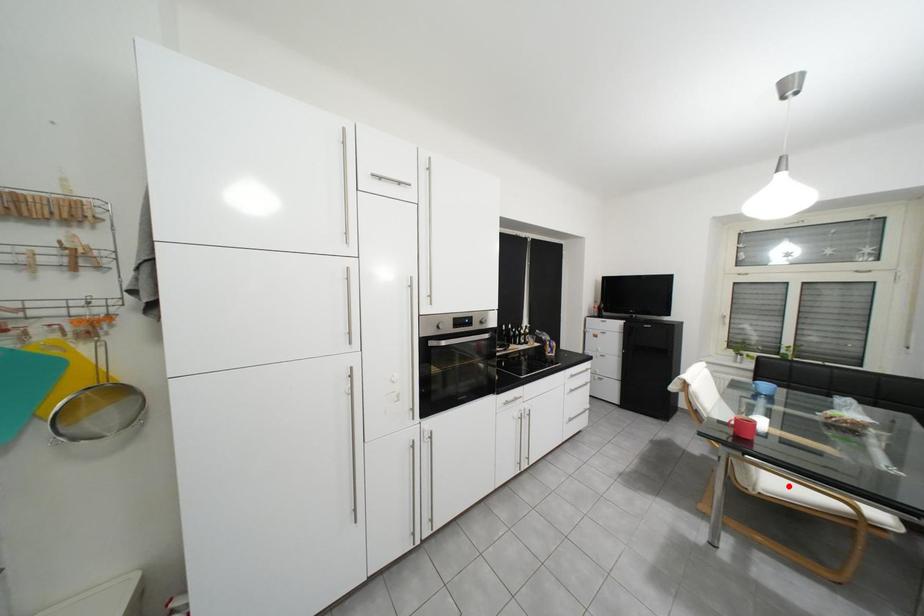
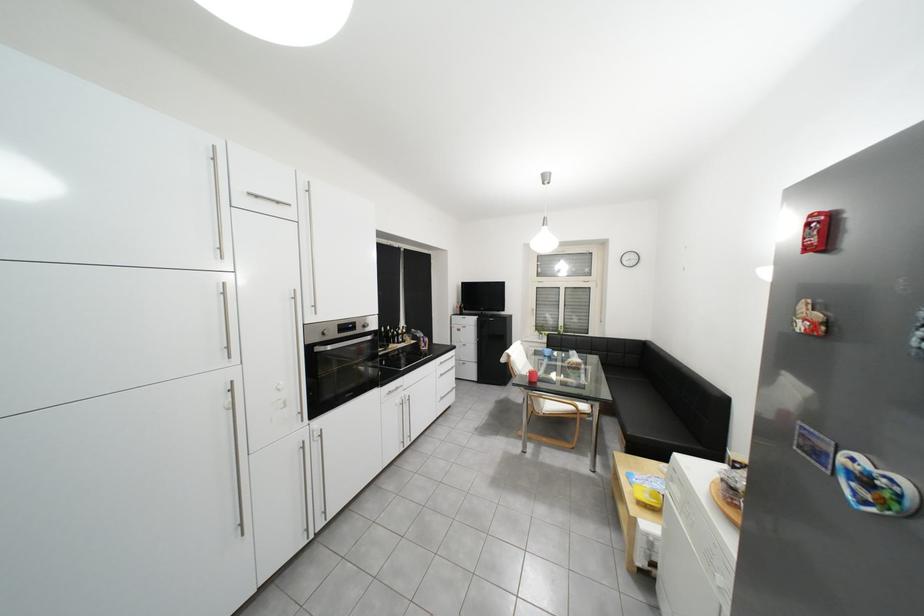
Question: A red point is marked in image1. In image2, is the corresponding 3D point closer to the camera or farther? Reply with the corresponding letter.

Choices:
 (A) The corresponding 3D point is closer.
 (B) The corresponding 3D point is farther.

Answer: (B)